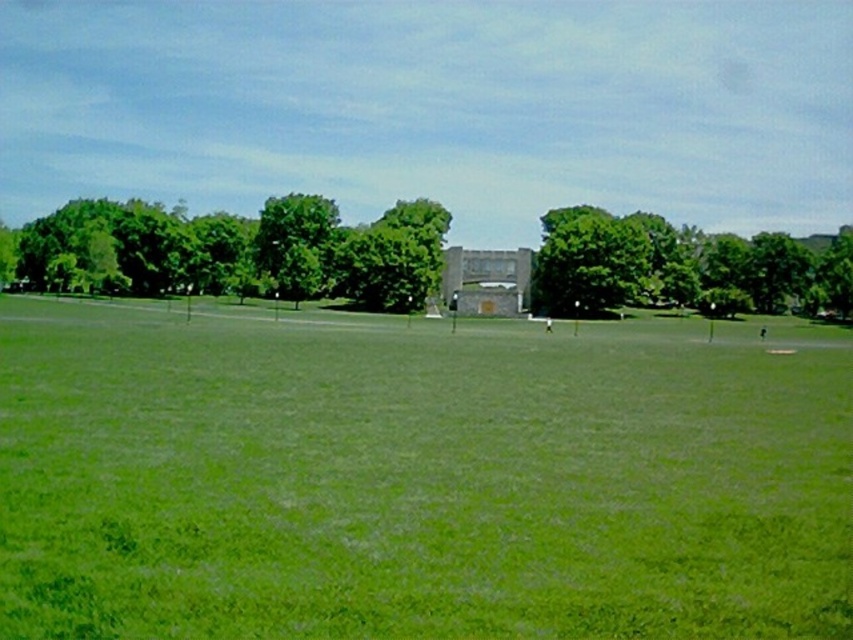
Question: Which object is the farthest from the green leafy tree at center?

Choices:
 (A) green grassy field at center
 (B) green leafy tree at upper center

Answer: (A)

Question: Does green grassy field at center come in front of green leafy tree at upper center?

Choices:
 (A) no
 (B) yes

Answer: (B)

Question: Based on their relative distances, which object is nearer to the green leafy tree at center?

Choices:
 (A) green grassy field at center
 (B) green leafy tree at upper center

Answer: (B)

Question: Does green leafy tree at upper center have a larger size compared to green leafy tree at center?

Choices:
 (A) no
 (B) yes

Answer: (A)

Question: Does green leafy tree at upper center have a lesser width compared to green leafy tree at center?

Choices:
 (A) no
 (B) yes

Answer: (A)

Question: Which of the following is the closest to the observer?

Choices:
 (A) (685, 228)
 (B) (242, 294)

Answer: (B)